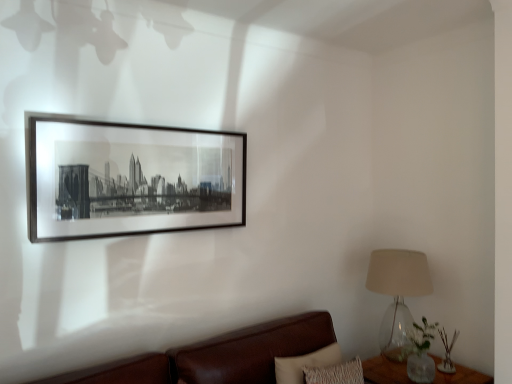
Question: Considering their positions, is green glass vase at lower right located in front of or behind translucent glass lampshade at right?

Choices:
 (A) behind
 (B) front

Answer: (A)

Question: Is green glass vase at lower right taller or shorter than translucent glass lampshade at right?

Choices:
 (A) short
 (B) tall

Answer: (A)

Question: Estimate the real-world distances between objects in this image. Which object is farther from the brown leather couch at lower right?

Choices:
 (A) clear glass table at lower right
 (B) translucent glass lampshade at right
 (C) black matte picture frame at upper center
 (D) green glass vase at lower right

Answer: (D)

Question: Considering the real-world distances, which object is farthest from the clear glass table at lower right?

Choices:
 (A) brown leather couch at lower right
 (B) translucent glass lampshade at right
 (C) green glass vase at lower right
 (D) black matte picture frame at upper center

Answer: (D)